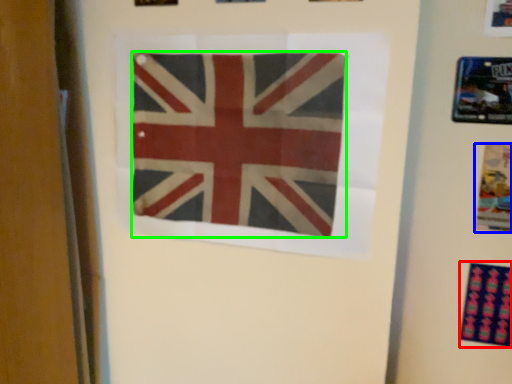
Question: Which object is positioned farthest from print (highlighted by a red box)? Select from poster (highlighted by a blue box) and flag (highlighted by a green box).

Choices:
 (A) poster
 (B) flag

Answer: (B)